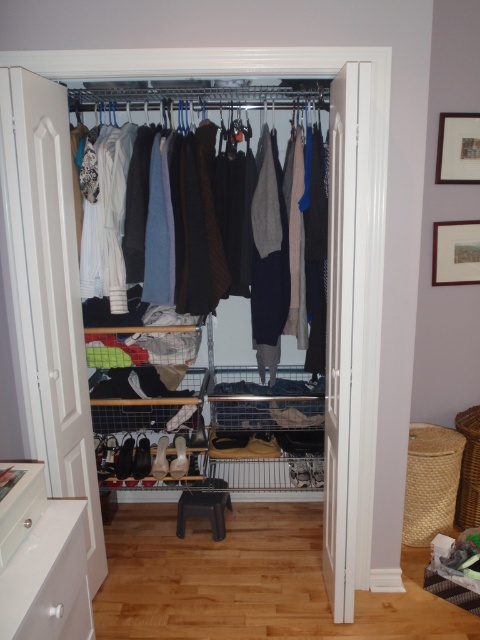
You are organizing your closet and need to place a new pair of shoes. The metallic wire rack at center is currently holding folded clothes. Can you move the folded clothes to the knit sweater at center to make space?

The metallic wire rack at center is in front of the knit sweater at center, so you can move the folded clothes from the metallic wire rack at center to the knit sweater at center area to create space for the new shoes.

You are standing in front of the open closet and see two points marked on the floor. The first point is at coordinates point (339, 180) and the second point is at point (238, 196). Which point is closer to you?

Point (339, 180) is in front of point (238, 196), so the first point is closer to you.